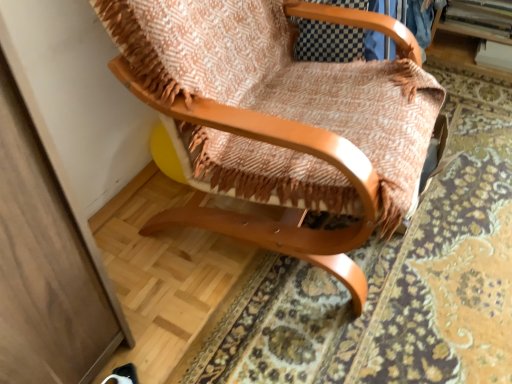
Identify the location of vacant space in front of wooden chair at center. The width and height of the screenshot is (512, 384). (281, 329).